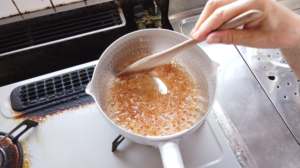
This screenshot has width=300, height=168. I want to click on handle, so click(169, 150).